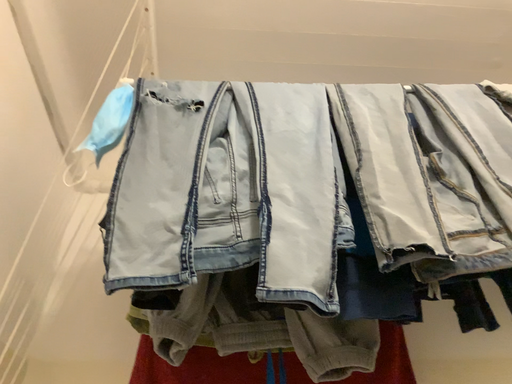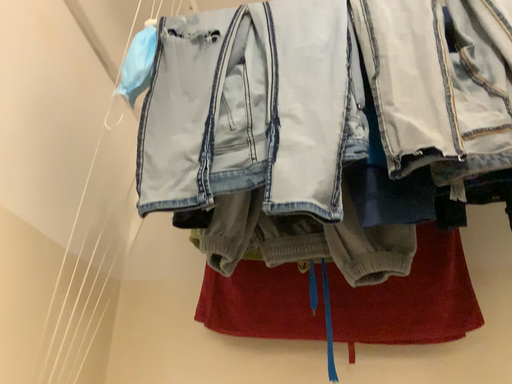
Question: How did the camera likely rotate when shooting the video?

Choices:
 (A) rotated left
 (B) rotated right

Answer: (A)